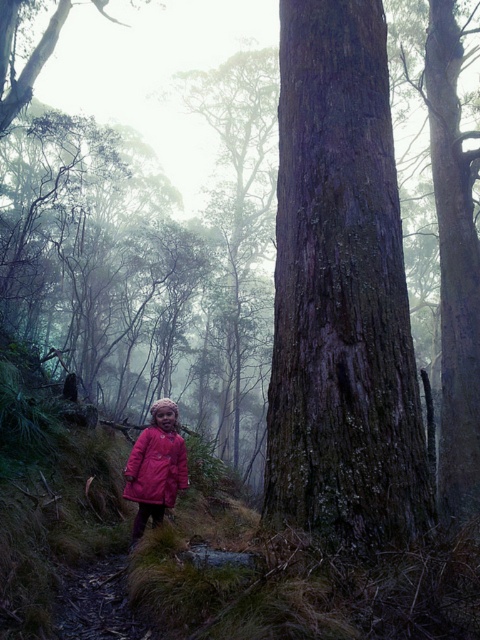
You are a photographer standing in the forest scene. You want to take a photo of the smooth brown bark at center and the matte pink coat at center. To ensure both are in frame, should you adjust your camera to focus more to the right or left?

The smooth brown bark at center is to the right of the matte pink coat at center. To include both in the frame, you should adjust your camera to focus more to the right so that both the bark and the coat are visible.

You are a photographer trying to capture both the smooth brown bark at center and the matte pink coat at center in a single frame. Based on their sizes, which object should you focus on to ensure both are clearly visible?

The smooth brown bark at center is wider than the matte pink coat at center, so focusing on the smooth brown bark at center would allow both to be captured clearly in the frame.